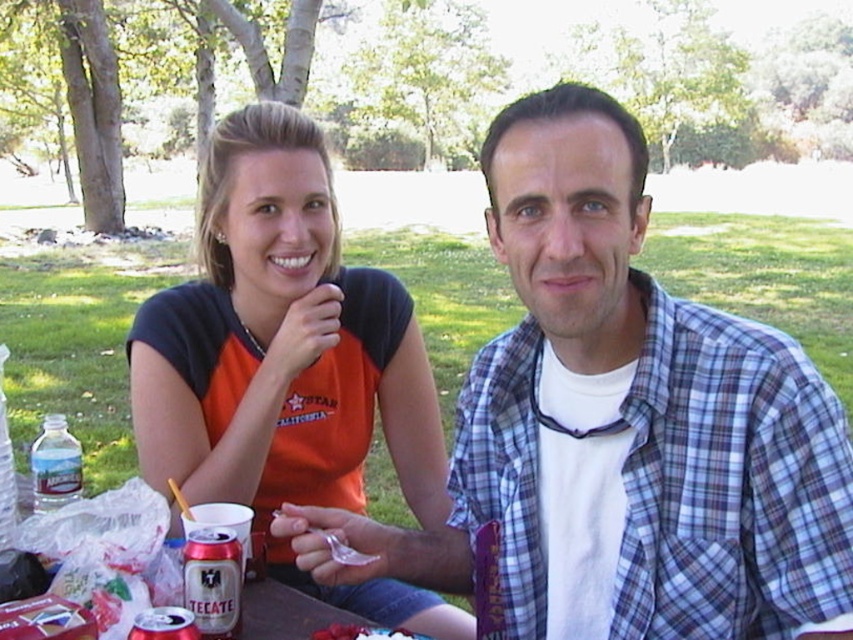
Question: Which object is the farthest from the clear plastic water at bottle left?

Choices:
 (A) silver metallic can at lower left
 (B) orange fabric shirt at upper left

Answer: (B)

Question: Which point is closer to the camera?

Choices:
 (A) (239, 618)
 (B) (241, 211)
 (C) (505, 620)

Answer: (A)

Question: Which is nearer to the orange fabric shirt at upper left?

Choices:
 (A) silver metallic can at lower left
 (B) plaid cotton shirt at center
 (C) clear plastic water at bottle left

Answer: (B)

Question: Can you confirm if plaid cotton shirt at center is positioned to the right of silver metallic can at lower left?

Choices:
 (A) no
 (B) yes

Answer: (B)

Question: Is orange fabric shirt at upper left behind clear plastic water at bottle left?

Choices:
 (A) no
 (B) yes

Answer: (B)

Question: Can you confirm if plaid cotton shirt at center is positioned to the right of orange fabric shirt at upper left?

Choices:
 (A) yes
 (B) no

Answer: (A)